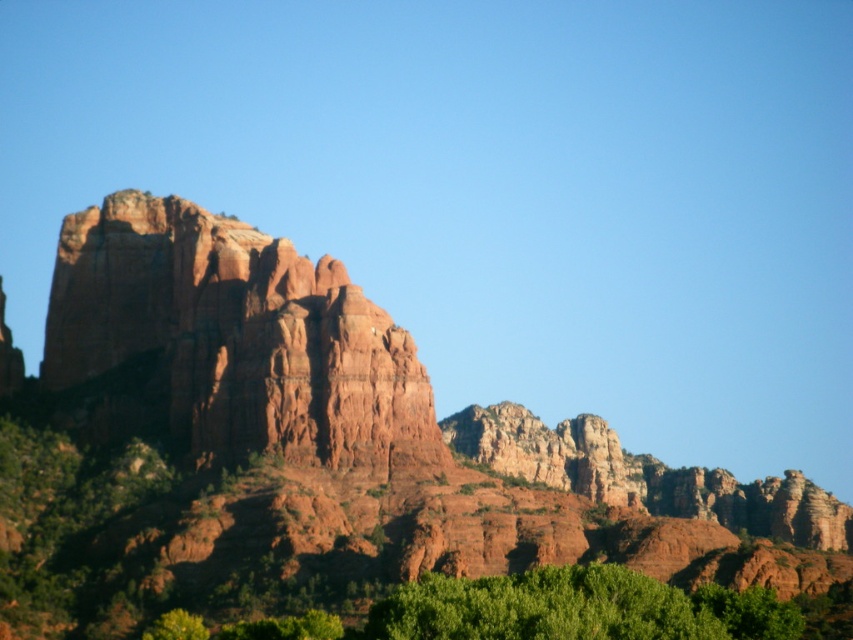
Question: Which point is closer to the camera taking this photo?

Choices:
 (A) (161, 384)
 (B) (178, 397)

Answer: (B)

Question: Which of the following is the farthest from the observer?

Choices:
 (A) reddish-brown rock formation at center-left
 (B) rustic rock formation at center

Answer: (A)

Question: Which point is closer to the camera?

Choices:
 (A) rustic rock formation at center
 (B) reddish-brown rock formation at center-left

Answer: (A)

Question: Can you confirm if rustic rock formation at center is positioned to the left of reddish-brown rock formation at center-left?

Choices:
 (A) no
 (B) yes

Answer: (A)

Question: Is rustic rock formation at center closer to camera compared to reddish-brown rock formation at center-left?

Choices:
 (A) no
 (B) yes

Answer: (B)

Question: Does rustic rock formation at center lie behind reddish-brown rock formation at center-left?

Choices:
 (A) no
 (B) yes

Answer: (A)